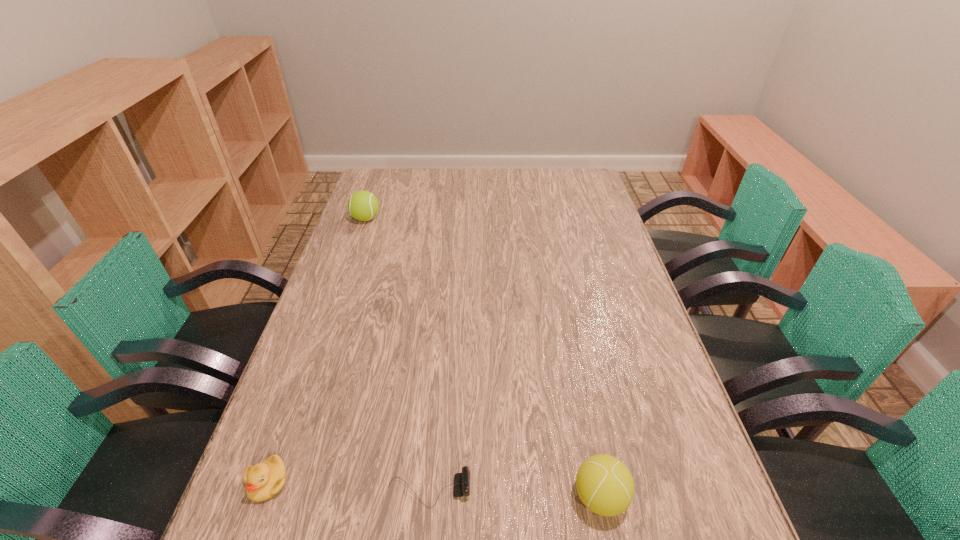
I want to click on empty space that is in between the second object from right to left and the farther tennis ball, so click(x=397, y=354).

The width and height of the screenshot is (960, 540). In order to click on vacant space that's between the nearer tennis ball and the second shortest object in this screenshot , I will do `click(434, 489)`.

Image resolution: width=960 pixels, height=540 pixels. What are the coordinates of `vacant space that's between the farthest object and the rightmost object` in the screenshot? It's located at (483, 357).

Identify the location of vacant point located between the third object from left to right and the farther tennis ball. (397, 354).

The height and width of the screenshot is (540, 960). In order to click on object that is the third nearest to the third object from left to right in this screenshot , I will do `click(363, 205)`.

Find the location of a particular element. the third closest object to the shortest object is located at coordinates (363, 205).

Identify the location of free location that satisfies the following two spatial constraints: 1. on the front-facing side of the shortest object; 2. on the left side of the rightmost object. Image resolution: width=960 pixels, height=540 pixels. (428, 497).

I want to click on blank area in the image that satisfies the following two spatial constraints: 1. at the face of the duckling; 2. on the left side of the nearer tennis ball, so click(263, 497).

What are the coordinates of `free space that satisfies the following two spatial constraints: 1. on the front-facing side of the third object from left to right; 2. on the back side of the nearer tennis ball` in the screenshot? It's located at (428, 497).

Find the location of a particular element. This screenshot has height=540, width=960. vacant space that satisfies the following two spatial constraints: 1. on the back side of the nearer tennis ball; 2. on the front-facing side of the second object from right to left is located at coordinates point(599,490).